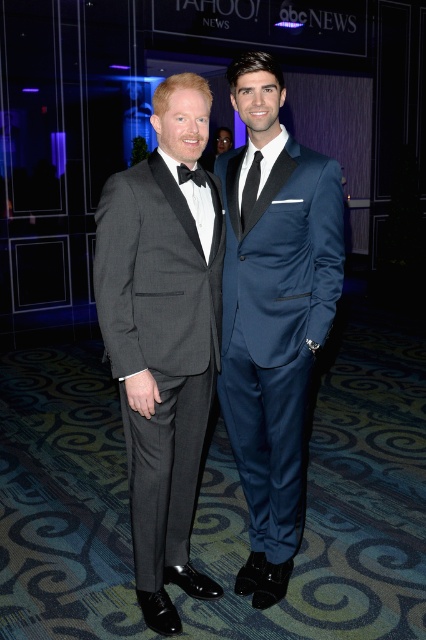
You are a photographer standing 6 feet away from the satin blue suit at center. Can you capture a clear photo of the suit without moving closer?

The satin blue suit at center and viewer are 6.23 feet apart, so yes, you can capture a clear photo of the suit without moving closer since the distance is sufficient.